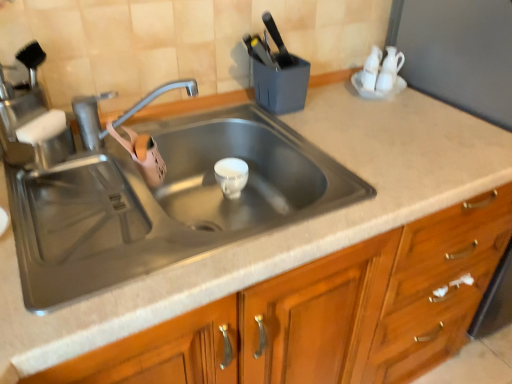
Identify the location of vacant space situated above wooden cabinet at center (from a real-world perspective). (326, 160).